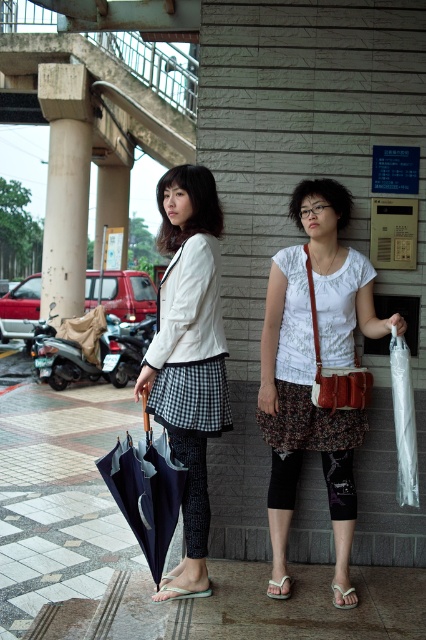
Who is positioned more to the right, polished concrete pavement at center or rustic felt crossbody bag at center?

From the viewer's perspective, rustic felt crossbody bag at center appears more on the right side.

Between point (29, 570) and point (362, 404), which one is positioned in front?

Point (362, 404) is in front.

The image size is (426, 640). I want to click on polished concrete pavement at center, so click(x=137, y=545).

Is point (236, 602) positioned after point (316, 230)?

No, it is in front of (316, 230).

Which is in front, point (58, 440) or point (319, 339)?

Point (319, 339) is more forward.

This screenshot has width=426, height=640. What do you see at coordinates (137, 545) in the screenshot? I see `polished concrete pavement at center` at bounding box center [137, 545].

This screenshot has width=426, height=640. I want to click on polished concrete pavement at center, so click(137, 545).

Locate an element on the screen. Image resolution: width=426 pixels, height=640 pixels. dark blue fabric umbrella at lower left is located at coordinates (146, 490).

Where is `dark blue fabric umbrella at lower left`? The image size is (426, 640). dark blue fabric umbrella at lower left is located at coordinates (146, 490).